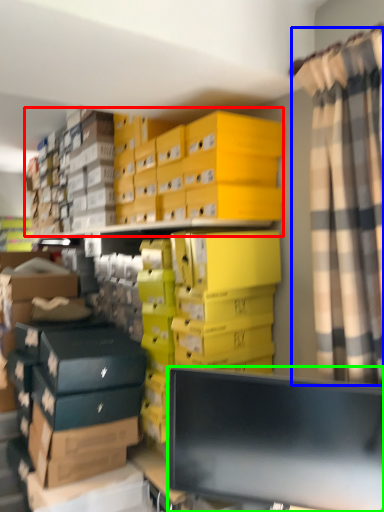
Question: Which object is the closest to the storage box (highlighted by a red box)? Choose among these: curtain (highlighted by a blue box) or computer monitor (highlighted by a green box).

Choices:
 (A) curtain
 (B) computer monitor

Answer: (A)